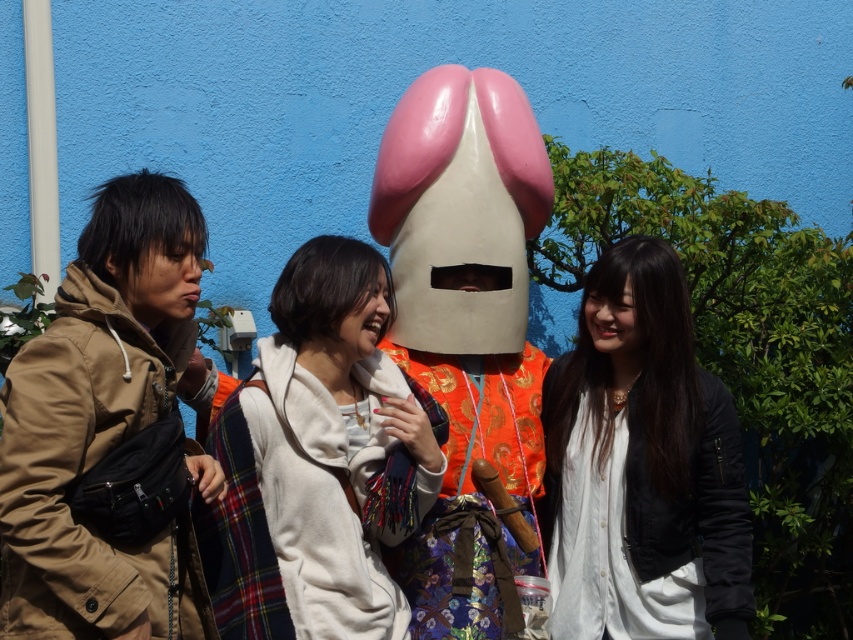
Is brown matte jacket at left positioned at the back of white soft scarf at center?

No, it is in front of white soft scarf at center.

Is brown matte jacket at left thinner than white soft scarf at center?

Correct, brown matte jacket at left's width is less than white soft scarf at center's.

Which is in front, point (111, 314) or point (299, 326)?

Point (111, 314) is in front.

This screenshot has height=640, width=853. What are the coordinates of `brown matte jacket at left` in the screenshot? It's located at (99, 419).

Which is in front, point (445, 579) or point (358, 250)?

Point (358, 250)

Who is more forward, [387,221] or [256,458]?

Point [256,458]

Locate an element on the screen. glossy plastic mask at center is located at coordinates (466, 330).

How far apart are brown matte jacket at left and orange fabric costume at center?

brown matte jacket at left is 4.70 feet away from orange fabric costume at center.

Who is more forward, (161, 612) or (497, 365)?

Positioned in front is point (161, 612).

You are a GUI agent. You are given a task and a screenshot of the screen. Output one action in this format:
    pyautogui.click(x=<x>, y=<y>)
    Task: Click on the brown matte jacket at left
    This screenshot has width=853, height=640.
    Given the screenshot: What is the action you would take?
    pyautogui.click(x=99, y=419)